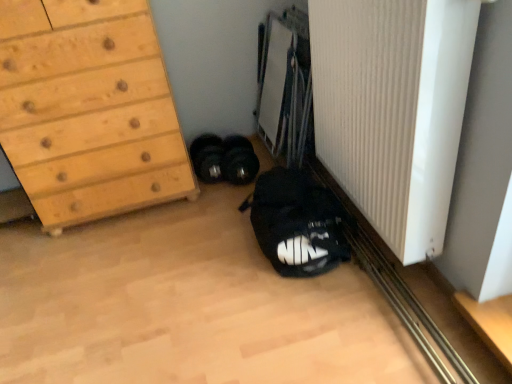
You are a GUI agent. You are given a task and a screenshot of the screen. Output one action in this format:
    pyautogui.click(x=<x>, y=<y>)
    Task: Click on the free space in front of wooden chest of drawers at left
    This screenshot has height=384, width=512.
    Given the screenshot: What is the action you would take?
    tap(113, 263)